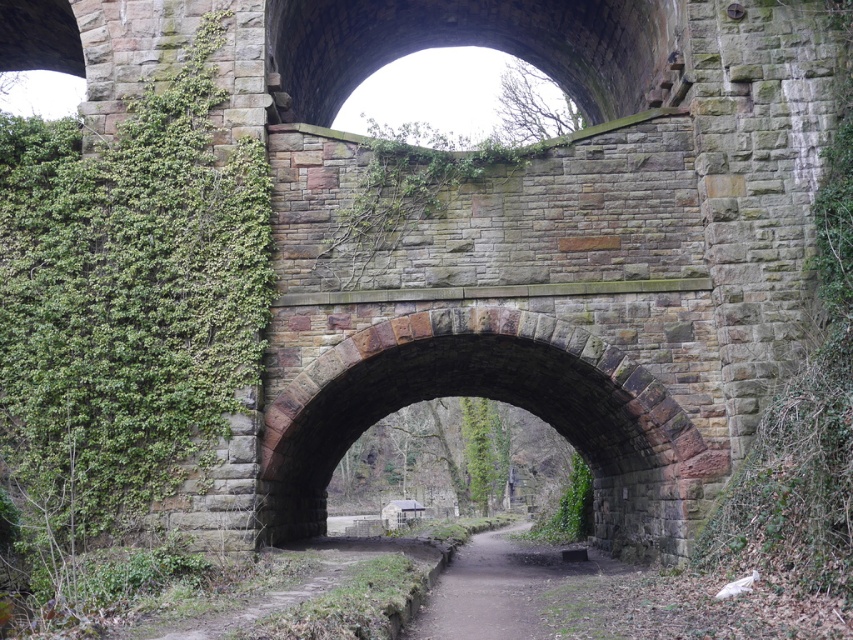
A drone is flying at the point labeled point (57,138). The drone needs to travel to a point that is 55.87 meters away. Is there enough space between the two points for the drone to safely land?

The distance between the point labeled point (57,138) and the destination is 55.87 meters. The drone has sufficient space to safely land as long as there are no obstacles in the flight path. However, the scene description mentions the presence of ivy and climbing plants on the archway, which might pose a risk if the landing area is near the structure. Ensure the landing zone is clear of vegetation and obstructions.

You are standing at the base of the stone archway and notice two points marked in the scene. The first point is at coordinates point [51,224] and the second is at point [463,637]. Which of these two points is closer to you?

Point [463,637] is closer to you because it is in front of point [51,224].